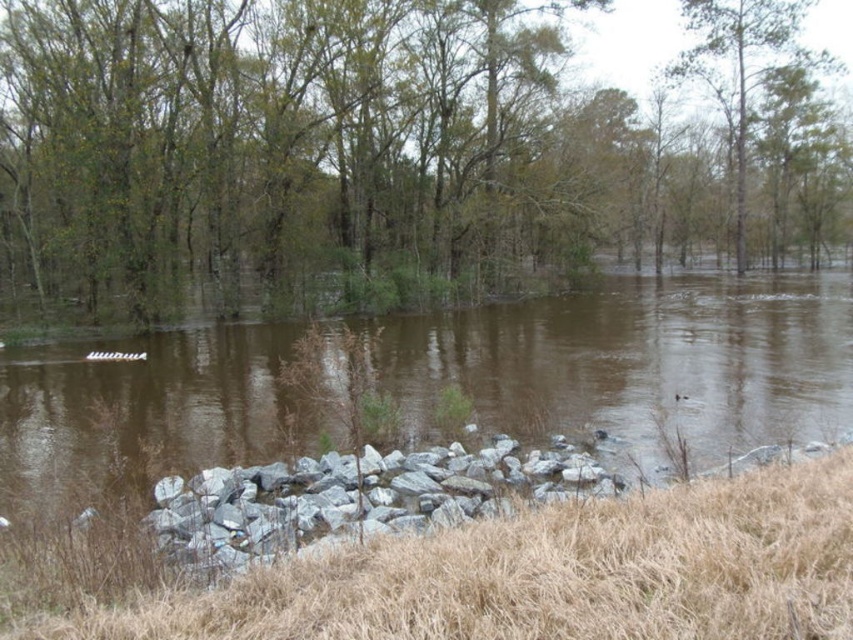
Question: Which of the following is the farthest from the observer?

Choices:
 (A) green leafy tree at upper center
 (B) brown leafy tree at center

Answer: (A)

Question: Can you confirm if brown leafy tree at center is wider than green leafy tree at upper center?

Choices:
 (A) no
 (B) yes

Answer: (B)

Question: Which point is closer to the camera taking this photo?

Choices:
 (A) click(744, 161)
 (B) click(306, 72)

Answer: (B)

Question: Which object is farther from the camera taking this photo?

Choices:
 (A) brown leafy tree at center
 (B) green leafy tree at upper center

Answer: (B)

Question: Does brown leafy tree at center appear under green leafy tree at upper center?

Choices:
 (A) yes
 (B) no

Answer: (A)

Question: Is the position of brown leafy tree at center more distant than that of green leafy tree at upper center?

Choices:
 (A) no
 (B) yes

Answer: (A)